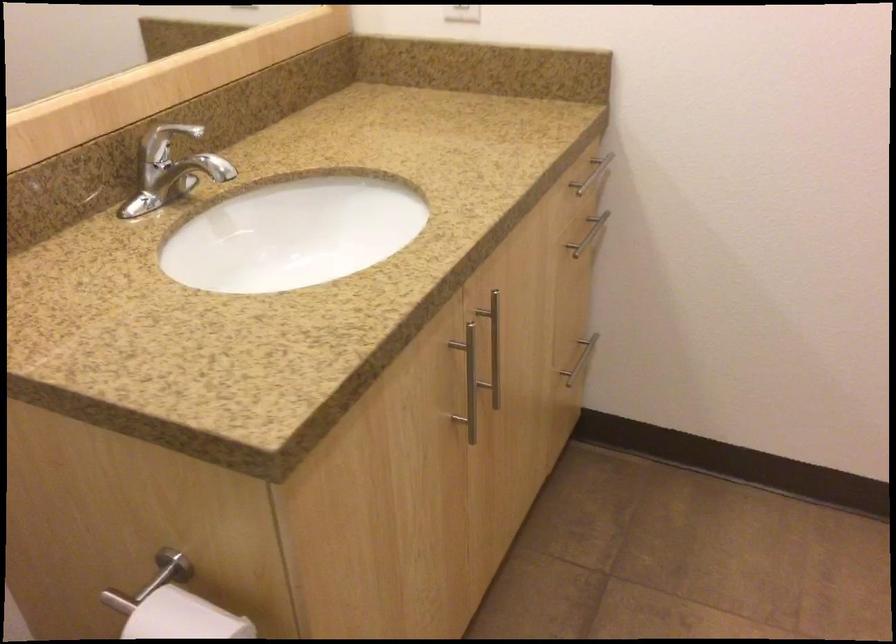
At what (x,y) coordinates should I click in order to perform the action: click on chrome faucet handle. Please return your answer as a coordinate pair (x, y). The width and height of the screenshot is (896, 644). Looking at the image, I should click on (165, 140).